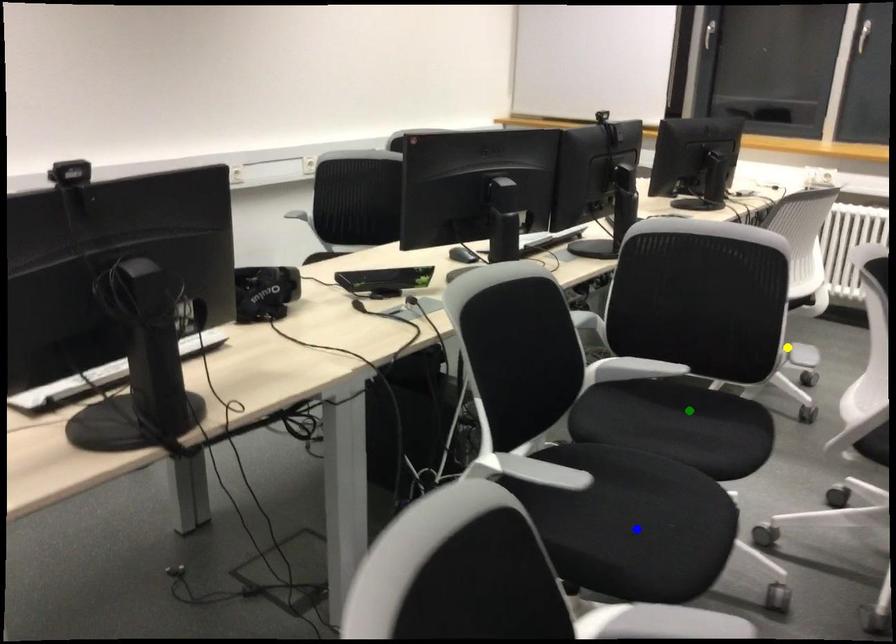
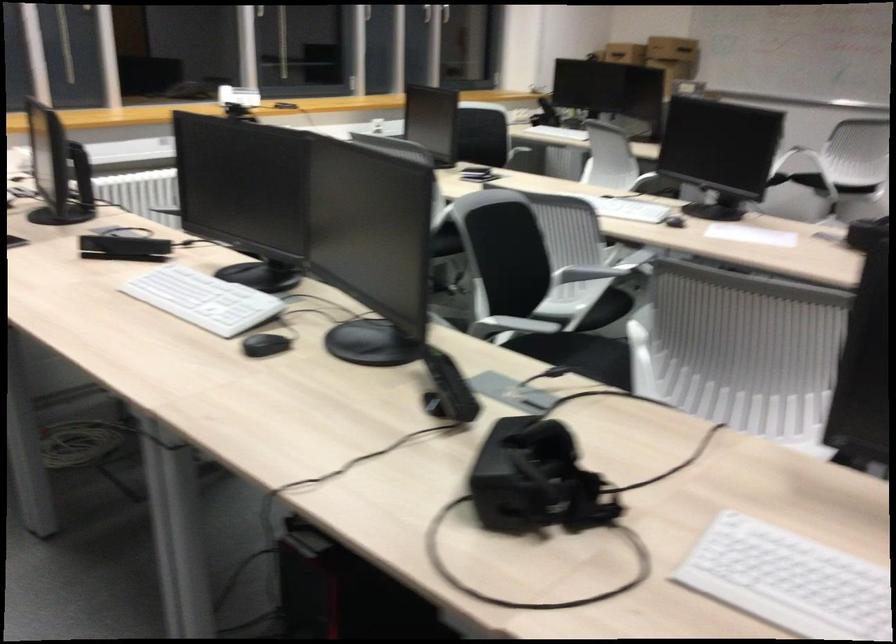
I am providing you with two images of the same scene from different viewpoints. Three points are marked in image1. Which point corresponds to a part or object that is occluded in image2?In image1, three points are marked. Which of them correspond to a part or object that is occluded in image2?Among the three points shown in image1, which one corresponds to a part or object that is no longer visible due to occlusion in image2?

blue point